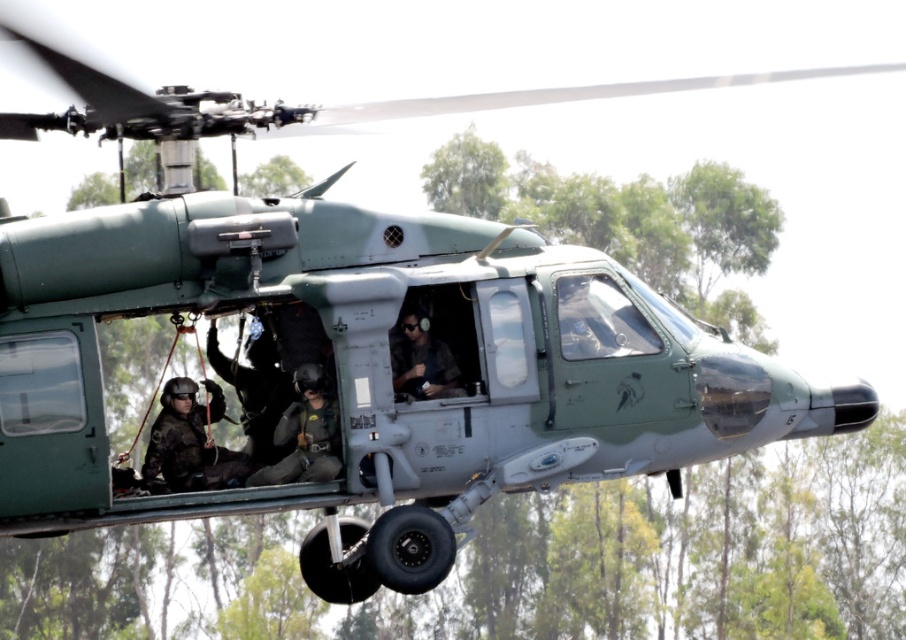
Between black tactical vest at center and matte black helmet at center, which one is positioned higher?

matte black helmet at center is higher up.

Can you confirm if black tactical vest at center is taller than matte black helmet at center?

Yes, black tactical vest at center is taller than matte black helmet at center.

Based on the photo, who is more distant from viewer, (x=247, y=456) or (x=392, y=346)?

The point (x=247, y=456) is behind.

The height and width of the screenshot is (640, 906). Find the location of `black tactical vest at center`. black tactical vest at center is located at coordinates (190, 442).

Who is more distant from viewer, (181, 404) or (325, 467)?

Point (181, 404)

Is black tactical vest at center thinner than camouflage fabric helmet at center?

Correct, black tactical vest at center's width is less than camouflage fabric helmet at center's.

Which is in front, point (184, 484) or point (329, 472)?

Point (329, 472)

At what (x,y) coordinates should I click in order to perform the action: click on black tactical vest at center. Please return your answer as a coordinate pair (x, y). Looking at the image, I should click on (190, 442).

Looking at this image, does camouflage fabric helmet at center appear over matte black helmet at center?

Actually, camouflage fabric helmet at center is below matte black helmet at center.

Is point (295, 385) more distant than point (402, 312)?

Yes, point (295, 385) is behind point (402, 312).

Does point (307, 406) lie behind point (412, 339)?

No.

Locate an element on the screen. camouflage fabric helmet at center is located at coordinates (305, 433).